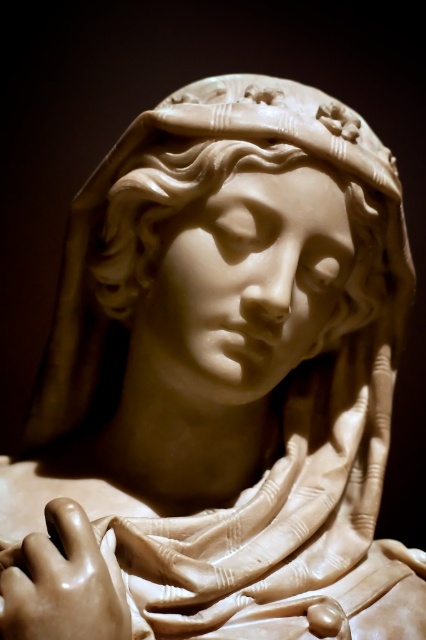
Question: Is matte white sculpture at center above matte beige hand at lower left?

Choices:
 (A) yes
 (B) no

Answer: (A)

Question: Can you confirm if matte white sculpture at center is thinner than matte beige hand at lower left?

Choices:
 (A) no
 (B) yes

Answer: (A)

Question: Among these objects, which one is nearest to the camera?

Choices:
 (A) matte white sculpture at center
 (B) matte beige hand at lower left

Answer: (B)

Question: Does matte white sculpture at center appear on the right side of matte beige hand at lower left?

Choices:
 (A) no
 (B) yes

Answer: (B)